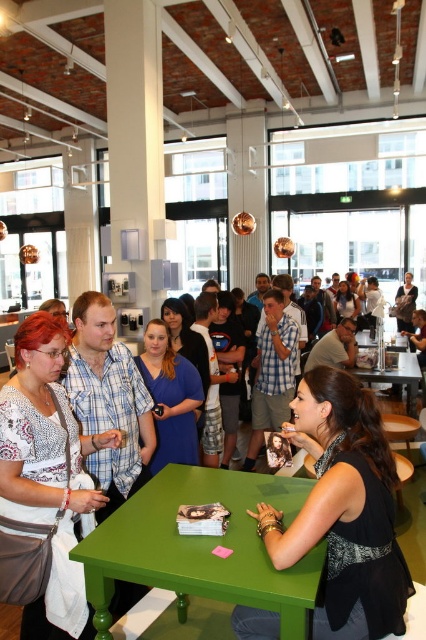
Does point (284, 500) come farther from viewer compared to point (368, 378)?

No.

This screenshot has width=426, height=640. Describe the element at coordinates (201, 547) in the screenshot. I see `green painted wood table at center` at that location.

Image resolution: width=426 pixels, height=640 pixels. Find the location of `green painted wood table at center`. green painted wood table at center is located at coordinates (201, 547).

Does black matte dress at lower right come in front of matte white shirt at center?

Yes, black matte dress at lower right is closer to the viewer.

Who is taller, black matte dress at lower right or matte white shirt at center?

matte white shirt at center is taller.

Is point (379, 536) more distant than point (48, 396)?

That is False.

Find the location of `black matte dress at lower right`. black matte dress at lower right is located at coordinates (344, 509).

Can you confirm if matte white shirt at center is positioned above green matte table at center?

No.

Does point (80, 493) come farther from viewer compared to point (409, 394)?

No, it is in front of (409, 394).

The image size is (426, 640). I want to click on matte white shirt at center, so click(x=43, y=429).